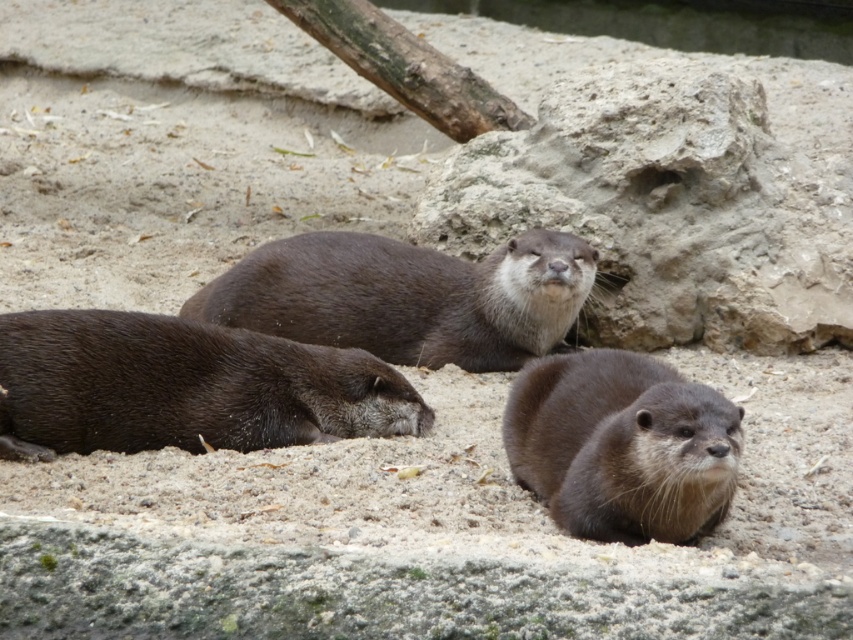
Between point (396, 412) and point (341, 280), which one is positioned in front?

Point (396, 412) is in front.

Where is `shiny brown otter at lower left`? Image resolution: width=853 pixels, height=640 pixels. shiny brown otter at lower left is located at coordinates (184, 387).

Does brown fur otter at center have a smaller size compared to brown furry otter at lower right?

Actually, brown fur otter at center might be larger than brown furry otter at lower right.

Does brown fur otter at center have a greater height compared to brown furry otter at lower right?

Yes.

Find the location of `brown fur otter at center`. brown fur otter at center is located at coordinates (407, 296).

This screenshot has height=640, width=853. I want to click on shiny brown otter at lower left, so click(184, 387).